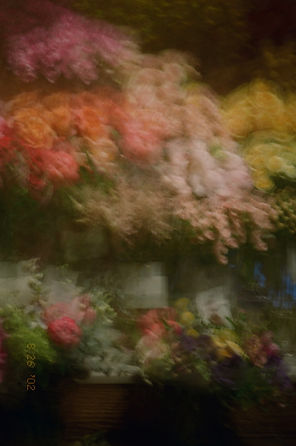
At what (x,y) coordinates should I click in order to perform the action: click on orange flowers. Please return your answer as a coordinate pair (x, y). The image size is (296, 446). Looking at the image, I should click on [x=71, y=114].